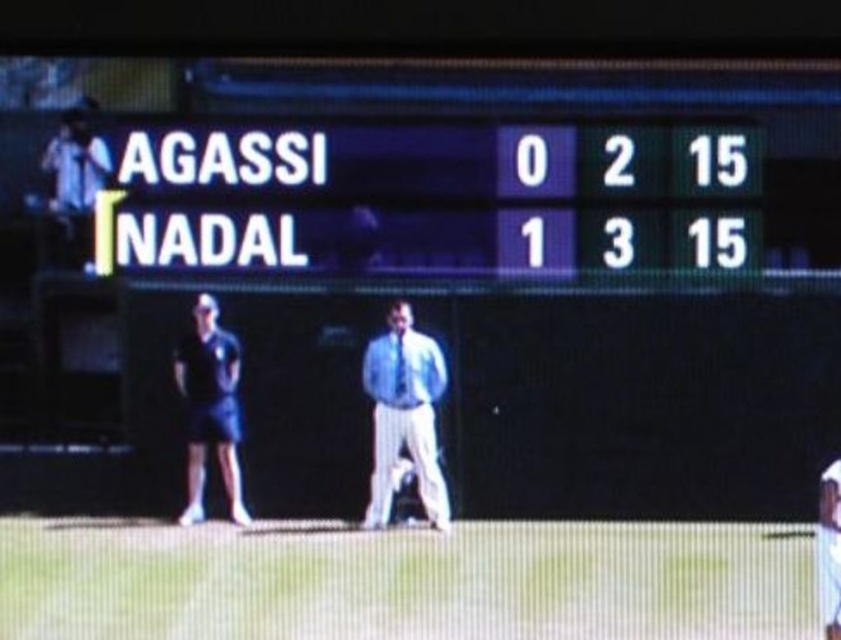
You are a photographer positioned in front of the scoreboard. You want to take a photo that includes both the light blue pinstripe pants at center and the white cotton shirt at lower right. Which object should you focus on first to ensure both are in the frame?

You should focus on the light blue pinstripe pants at center first since it is closer to you than the white cotton shirt at lower right, ensuring both are in the frame by starting with the closer object.

You are a spectator at the tennis match and notice two people near the scoreboard. Which of the two, the light blue pinstripe pants at center or the white cotton shirt at lower right, is taller?

The light blue pinstripe pants at center is much taller than the white cotton shirt at lower right.